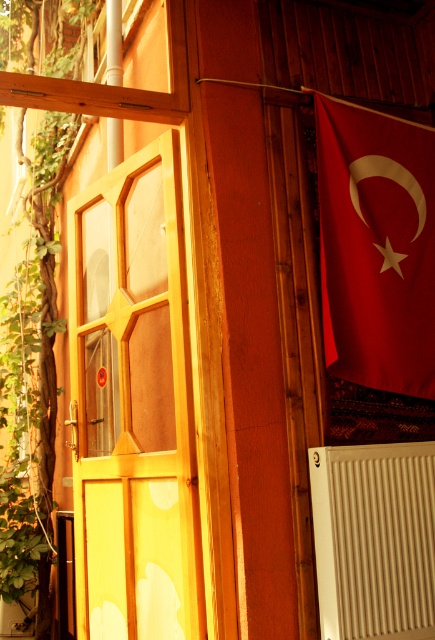
Question: Can you confirm if wooden door at left is positioned above red matte flag at upper right?

Choices:
 (A) no
 (B) yes

Answer: (A)

Question: Among these objects, which one is farthest from the camera?

Choices:
 (A) red matte flag at upper right
 (B) white ribbed radiator at lower right
 (C) wooden door at left

Answer: (A)

Question: Estimate the real-world distances between objects in this image. Which object is closer to the wooden door at left?

Choices:
 (A) red matte flag at upper right
 (B) white ribbed radiator at lower right

Answer: (B)

Question: Among these points, which one is nearest to the camera?

Choices:
 (A) (364, 556)
 (B) (397, 157)

Answer: (A)

Question: In this image, where is wooden door at left located relative to red matte flag at upper right?

Choices:
 (A) below
 (B) above

Answer: (A)

Question: Does wooden door at left have a greater width compared to red matte flag at upper right?

Choices:
 (A) no
 (B) yes

Answer: (B)